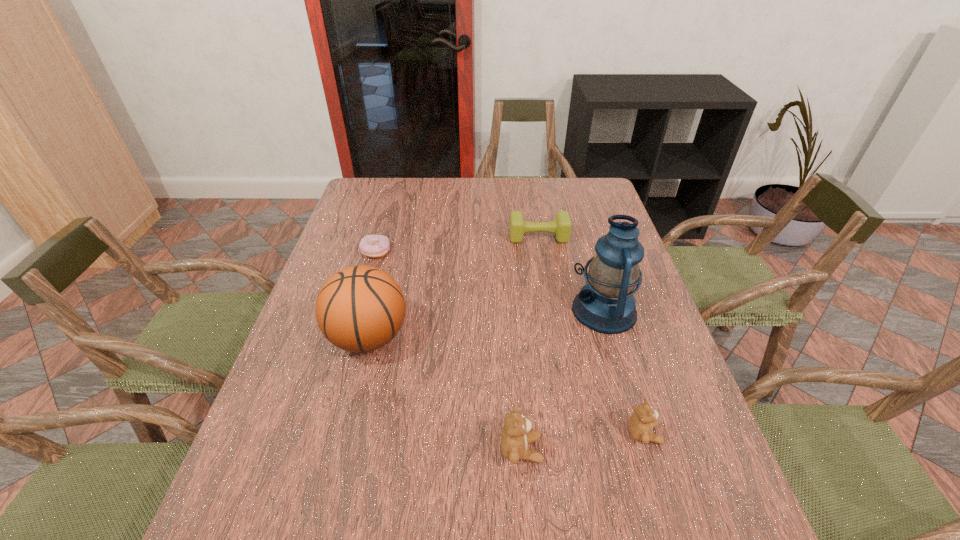
In the current image, all teddy bears are evenly spaced. To maintain this equal spacing, where should an additional teddy bear be placed on the left? Please point out a free spot. Please provide its 2D coordinates. Your answer should be formatted as a tuple, i.e. [(x, y)], where the tuple contains the x and y coordinates of a point satisfying the conditions above.

[(392, 466)]